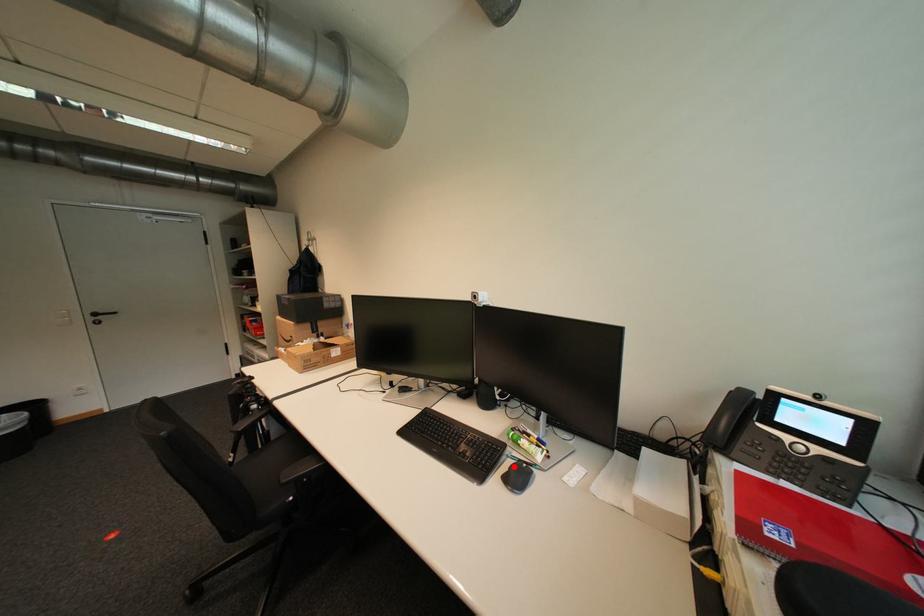
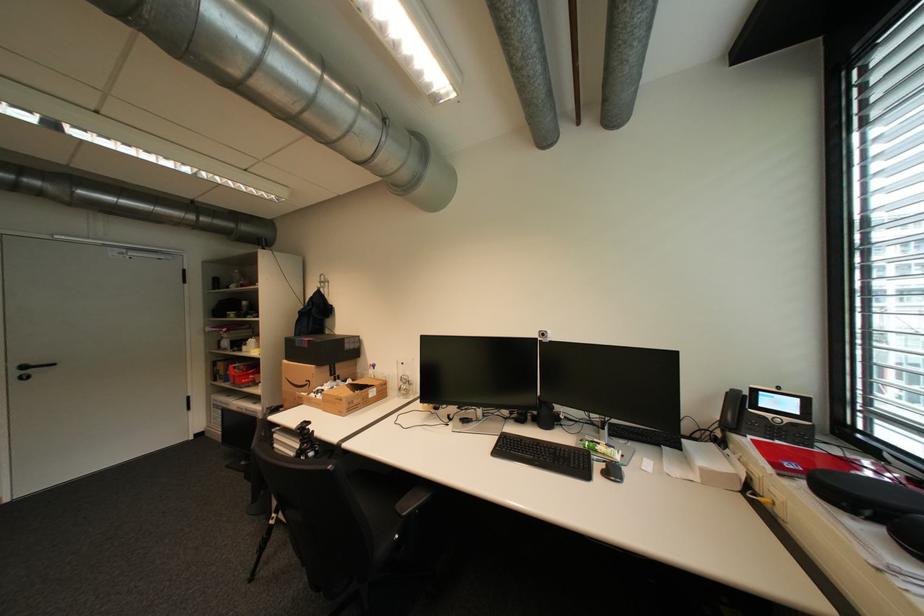
Where in the second image is the point corresponding to the highlighted location from the first image?

(606, 467)